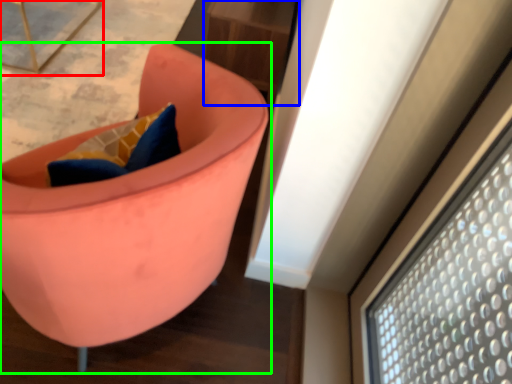
Question: Considering the real-world distances, which object is closest to furniture (highlighted by a red box)? table (highlighted by a blue box) or chair (highlighted by a green box).

Choices:
 (A) table
 (B) chair

Answer: (A)